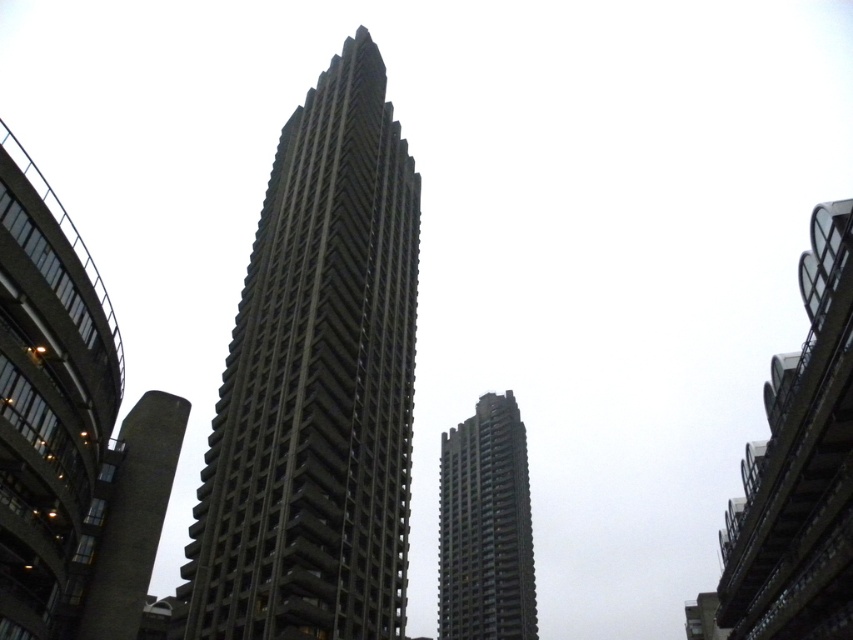
Consider the image. Between gray concrete tower at center and concrete textured building at center, which one has less height?

Standing shorter between the two is concrete textured building at center.

Can you confirm if gray concrete tower at center is positioned above concrete textured building at center?

Indeed, gray concrete tower at center is positioned over concrete textured building at center.

This screenshot has width=853, height=640. What do you see at coordinates (316, 385) in the screenshot? I see `gray concrete tower at center` at bounding box center [316, 385].

In order to click on gray concrete tower at center in this screenshot , I will do `click(316, 385)`.

In the scene shown: Who is shorter, gray concrete tower at center or dark gray concrete tower at center?

dark gray concrete tower at center

Is gray concrete tower at center above dark gray concrete tower at center?

Yes, gray concrete tower at center is above dark gray concrete tower at center.

Is point (302, 136) farther from viewer compared to point (480, 472)?

No, (302, 136) is closer to viewer.

Locate an element on the screen. gray concrete tower at center is located at coordinates (316, 385).

Based on the photo, can you confirm if concrete textured building at center is wider than dark gray concrete tower at center?

Incorrect, concrete textured building at center's width does not surpass dark gray concrete tower at center's.

Can you confirm if concrete textured building at center is shorter than dark gray concrete tower at center?

Correct, concrete textured building at center is not as tall as dark gray concrete tower at center.

Where is `concrete textured building at center`? This screenshot has width=853, height=640. concrete textured building at center is located at coordinates (70, 432).